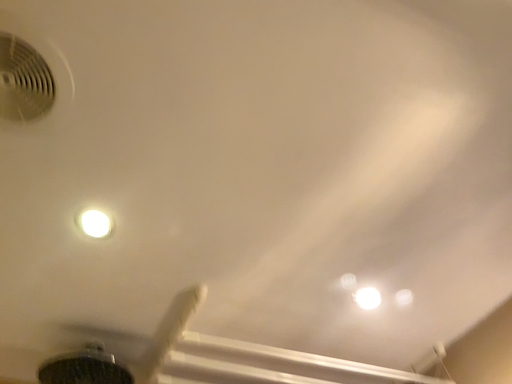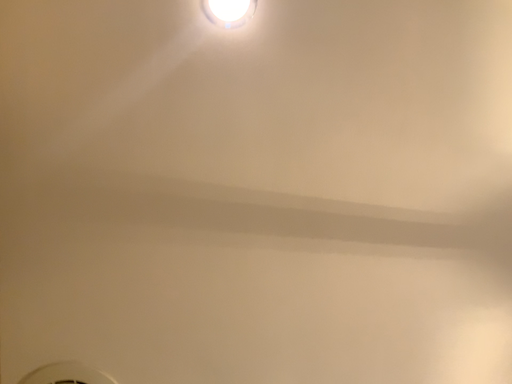
Question: Which way did the camera rotate in the video?

Choices:
 (A) rotated downward
 (B) rotated upward

Answer: (B)